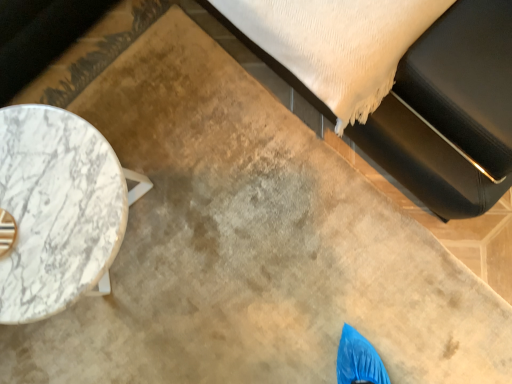
Where is `free space above white marble table at left (from a real-world perspective)`? Image resolution: width=512 pixels, height=384 pixels. free space above white marble table at left (from a real-world perspective) is located at coordinates (50, 211).